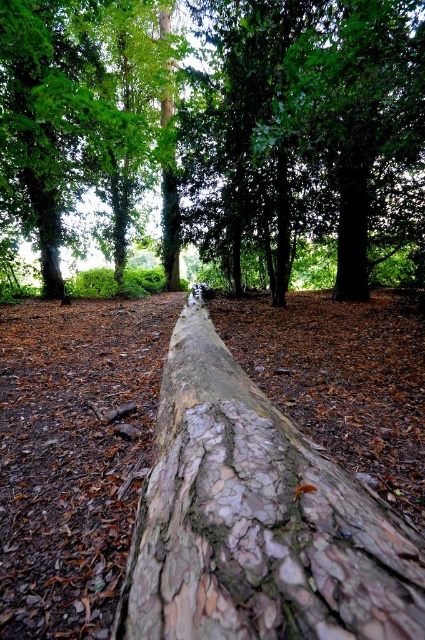
Can you confirm if rough bark log at center is positioned to the left of green rough bark tree at upper left?

In fact, rough bark log at center is to the right of green rough bark tree at upper left.

Can you confirm if rough bark log at center is smaller than green rough bark tree at upper left?

Yes.

I want to click on rough bark log at center, so click(257, 520).

Where is `rough bark log at center`? rough bark log at center is located at coordinates (257, 520).

Does smooth bark log at center have a lesser height compared to rough bark log at center?

No, smooth bark log at center is not shorter than rough bark log at center.

Which is above, smooth bark log at center or rough bark log at center?

smooth bark log at center

Where is `smooth bark log at center`? The height and width of the screenshot is (640, 425). smooth bark log at center is located at coordinates (223, 125).

Identify the location of smooth bark log at center. The image size is (425, 640). (223, 125).

Is smooth bark log at center bigger than green rough bark tree at upper left?

Correct, smooth bark log at center is larger in size than green rough bark tree at upper left.

Does point (61, 160) come closer to viewer compared to point (129, 195)?

Yes, it is in front of point (129, 195).

Identify the location of smooth bark log at center. Image resolution: width=425 pixels, height=640 pixels. (223, 125).